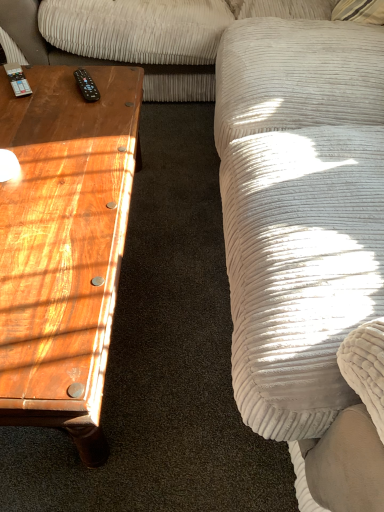
You are a GUI agent. You are given a task and a screenshot of the screen. Output one action in this format:
    pyautogui.click(x=<x>, y=<y>)
    Task: Click on the free point to the right of black plastic remote at upper left
    
    Given the screenshot: What is the action you would take?
    pyautogui.click(x=119, y=93)